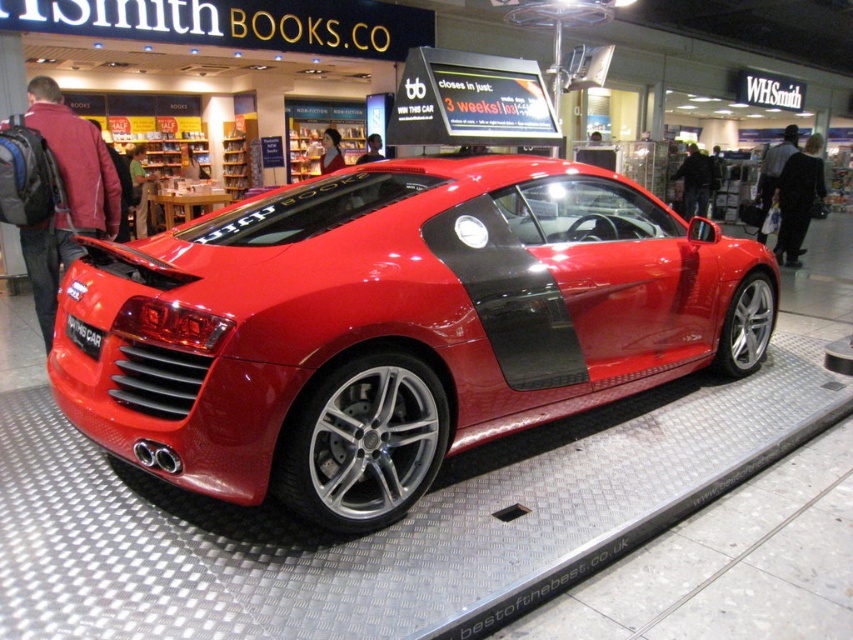
Question: Is shiny red sports car at center to the left of black matte license plate at center from the viewer's perspective?

Choices:
 (A) yes
 (B) no

Answer: (B)

Question: Among these points, which one is nearest to the camera?

Choices:
 (A) (397, 397)
 (B) (90, 339)

Answer: (B)

Question: Is shiny red sports car at center thinner than black matte license plate at center?

Choices:
 (A) yes
 (B) no

Answer: (B)

Question: Can you confirm if shiny red sports car at center is positioned above black matte license plate at center?

Choices:
 (A) yes
 (B) no

Answer: (A)